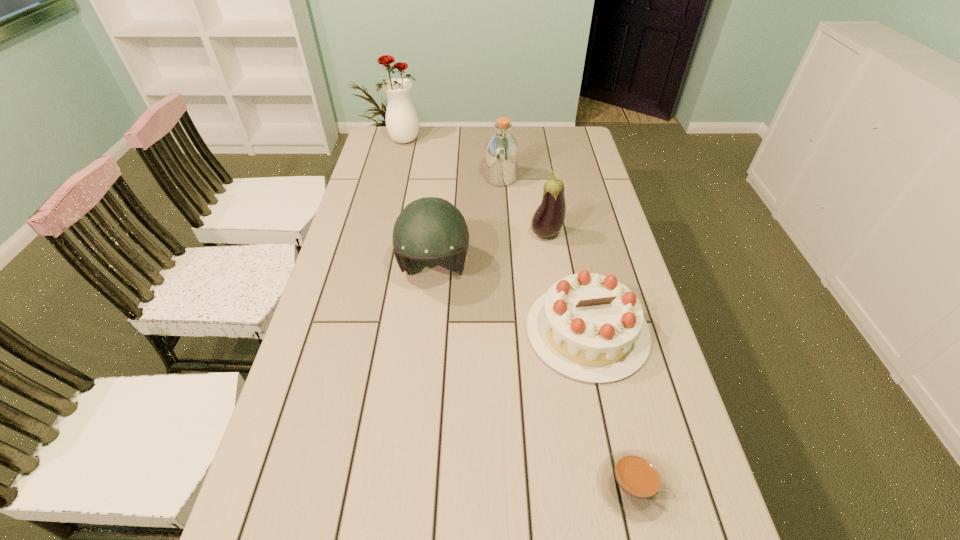
This screenshot has height=540, width=960. What are the coordinates of `the tallest object` in the screenshot? It's located at pyautogui.click(x=402, y=122).

This screenshot has width=960, height=540. Find the location of `the farthest object`. the farthest object is located at coordinates (402, 122).

This screenshot has width=960, height=540. I want to click on eggplant, so click(549, 217).

Locate an element on the screen. Image resolution: width=960 pixels, height=540 pixels. the second farthest object is located at coordinates click(x=502, y=151).

Where is `football helmet`? The height and width of the screenshot is (540, 960). football helmet is located at coordinates (430, 228).

The width and height of the screenshot is (960, 540). I want to click on birthday cake, so click(589, 327).

I want to click on cappuccino, so click(632, 482).

You are a GUI agent. You are given a task and a screenshot of the screen. Output one action in this format:
    pyautogui.click(x=<x>, y=<y>)
    Task: Click on the nearest object
    
    Given the screenshot: What is the action you would take?
    pyautogui.click(x=632, y=482)

Where is `blank space located 0.050m on the left of the vase`? The image size is (960, 540). blank space located 0.050m on the left of the vase is located at coordinates (373, 141).

Where is `vacant region located 0.270m on the left of the eggplant`? The width and height of the screenshot is (960, 540). vacant region located 0.270m on the left of the eggplant is located at coordinates (447, 235).